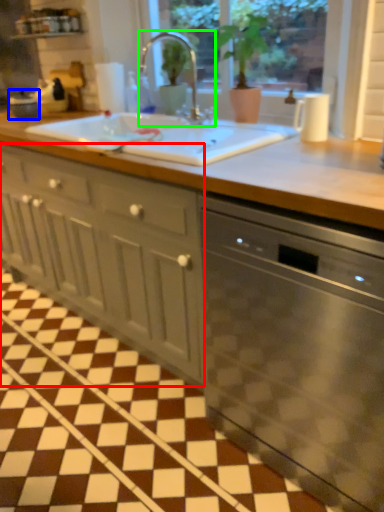
Question: Which is farther away from cabinetry (highlighted by a red box)? appliance (highlighted by a blue box) or tap (highlighted by a green box)?

Choices:
 (A) appliance
 (B) tap

Answer: (A)